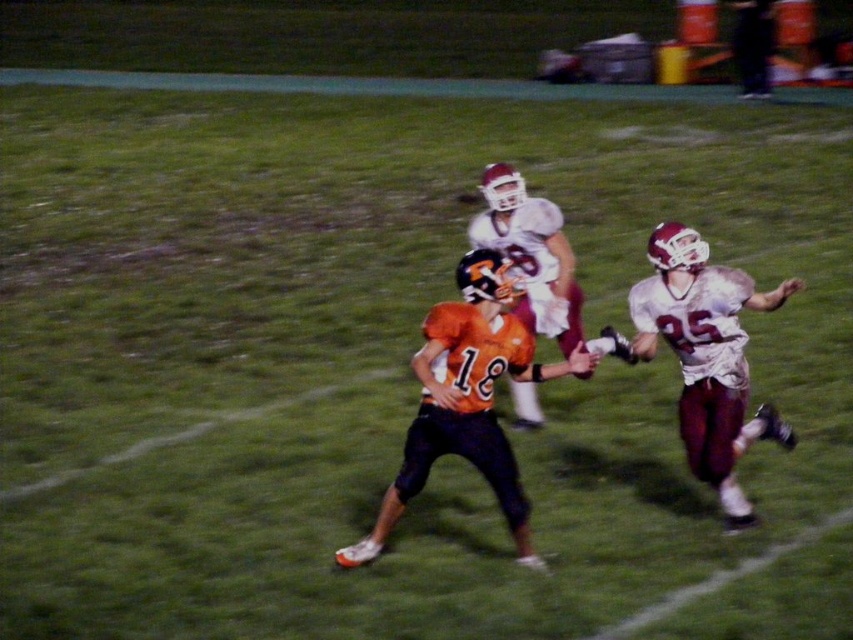
Question: Based on their relative distances, which object is farther from the orange jersey at center?

Choices:
 (A) white matte jersey at center
 (B) white matte jersey at center-right

Answer: (A)

Question: Among these objects, which one is nearest to the camera?

Choices:
 (A) orange jersey at center
 (B) white matte jersey at center-right
 (C) white matte jersey at center

Answer: (A)

Question: Is orange jersey at center to the left of white matte jersey at center-right from the viewer's perspective?

Choices:
 (A) yes
 (B) no

Answer: (A)

Question: Which object is farther from the camera taking this photo?

Choices:
 (A) white matte jersey at center-right
 (B) white matte jersey at center
 (C) orange jersey at center

Answer: (B)

Question: From the image, what is the correct spatial relationship of orange jersey at center in relation to white matte jersey at center?

Choices:
 (A) left
 (B) right

Answer: (A)

Question: Considering the relative positions of orange jersey at center and white matte jersey at center in the image provided, where is orange jersey at center located with respect to white matte jersey at center?

Choices:
 (A) below
 (B) above

Answer: (A)